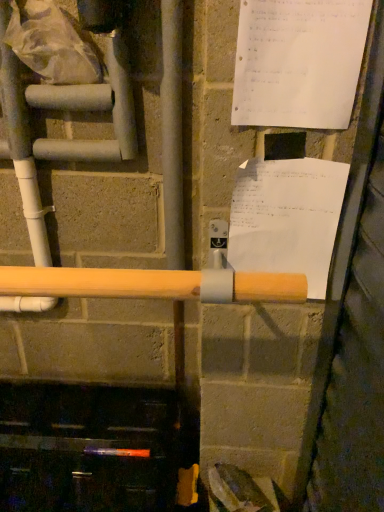
At what (x,y) coordinates should I click in order to perform the action: click on white plastic water pipe at left. Please return your answer as a coordinate pair (x, y). Looking at the image, I should click on (22, 146).

At what (x,y) coordinates should I click in order to perform the action: click on white paper at upper right, marked as the first paper in a back-to-front arrangement. Please return your answer as a coordinate pair (x, y). Image resolution: width=384 pixels, height=512 pixels. Looking at the image, I should click on (287, 218).

Identify the location of translucent plastic bag at upper left. (x=51, y=42).

What is the approximate width of translucent plastic bag at upper left?

It is 3.75 inches.

Image resolution: width=384 pixels, height=512 pixels. What do you see at coordinates (298, 62) in the screenshot? I see `white paper at upper right, the first paper when ordered from top to bottom` at bounding box center [298, 62].

Identify the location of white plastic water pipe at left. coord(22,146).

From the image's perspective, relative to white paper at upper right, the first paper when ordered from top to bottom, is white plastic water pipe at left above or below?

white plastic water pipe at left is situated lower than white paper at upper right, the first paper when ordered from top to bottom, in the image.

Do you think white plastic water pipe at left is within white paper at upper right, acting as the 1th paper starting from the front, or outside of it?

white plastic water pipe at left is located beyond the bounds of white paper at upper right, acting as the 1th paper starting from the front.

Would you consider white plastic water pipe at left to be distant from white paper at upper right, which is the second paper from back to front?

No, white plastic water pipe at left is not far from white paper at upper right, which is the second paper from back to front.

Does point (46, 237) appear closer or farther from the camera than point (336, 61)?

Point (46, 237) is farther from the camera than point (336, 61).

Does white paper at upper right, acting as the 1th paper starting from the front, lie in front of white paper at upper right, acting as the 2th paper starting from the top?

Yes, the depth of white paper at upper right, acting as the 1th paper starting from the front, is less than that of white paper at upper right, acting as the 2th paper starting from the top.

Where is `paper below the white paper at upper right, acting as the 1th paper starting from the front (from a real-world perspective)`? The image size is (384, 512). paper below the white paper at upper right, acting as the 1th paper starting from the front (from a real-world perspective) is located at coordinates (287, 218).

Does white paper at upper right, acting as the 1th paper starting from the front, turn towards white paper at upper right, positioned as the first paper in bottom-to-top order?

No, white paper at upper right, acting as the 1th paper starting from the front, is not turned towards white paper at upper right, positioned as the first paper in bottom-to-top order.

How different are the orientations of white paper at upper right, which is the second paper from back to front, and white paper at upper right, positioned as the first paper in bottom-to-top order, in degrees?

They differ by 0.0123 degrees in their facing directions.

Where is `plastic bag in front of the white plastic water pipe at left`? This screenshot has width=384, height=512. plastic bag in front of the white plastic water pipe at left is located at coordinates (51, 42).

Is white plastic water pipe at left surrounded by translucent plastic bag at upper left?

No, white plastic water pipe at left is located outside of translucent plastic bag at upper left.

Is translucent plastic bag at upper left at the right side of white plastic water pipe at left?

Correct, you'll find translucent plastic bag at upper left to the right of white plastic water pipe at left.

Which of these two, translucent plastic bag at upper left or white plastic water pipe at left, is thinner?

white plastic water pipe at left.

Can you confirm if white paper at upper right, the second paper when ordered from front to back, is positioned to the right of white paper at upper right, which is the second paper from back to front?

Incorrect, white paper at upper right, the second paper when ordered from front to back, is not on the right side of white paper at upper right, which is the second paper from back to front.

Between white paper at upper right, acting as the 2th paper starting from the top, and white paper at upper right, marked as the 2th paper in a bottom-to-top arrangement, which one has smaller width?

white paper at upper right, marked as the 2th paper in a bottom-to-top arrangement, is thinner.

From a real-world perspective, between white paper at upper right, acting as the 2th paper starting from the top, and white paper at upper right, the first paper when ordered from top to bottom, who is vertically lower?

In real-world perspective, white paper at upper right, acting as the 2th paper starting from the top, is lower.

Looking at this image, is white paper at upper right, marked as the 2th paper in a bottom-to-top arrangement, a part of white paper at upper right, marked as the first paper in a back-to-front arrangement?

That's incorrect, white paper at upper right, marked as the 2th paper in a bottom-to-top arrangement, is not inside white paper at upper right, marked as the first paper in a back-to-front arrangement.

How different are the orientations of white paper at upper right, marked as the first paper in a back-to-front arrangement, and translucent plastic bag at upper left in degrees?

The angle between the facing direction of white paper at upper right, marked as the first paper in a back-to-front arrangement, and the facing direction of translucent plastic bag at upper left is 2.91 degrees.

Is white paper at upper right, the second paper when ordered from front to back, inside the boundaries of translucent plastic bag at upper left, or outside?

white paper at upper right, the second paper when ordered from front to back, is located beyond the bounds of translucent plastic bag at upper left.

How much distance is there between white paper at upper right, marked as the first paper in a back-to-front arrangement, and translucent plastic bag at upper left?

A distance of 20.16 inches exists between white paper at upper right, marked as the first paper in a back-to-front arrangement, and translucent plastic bag at upper left.

From a real-world perspective, between white paper at upper right, marked as the first paper in a back-to-front arrangement, and translucent plastic bag at upper left, who is vertically higher?

In real-world perspective, translucent plastic bag at upper left is above.

Does translucent plastic bag at upper left have a greater height compared to white paper at upper right, positioned as the first paper in bottom-to-top order?

No.

Is the depth of translucent plastic bag at upper left greater than that of white paper at upper right, acting as the 2th paper starting from the top?

Yes, it is.

Is translucent plastic bag at upper left oriented away from white paper at upper right, positioned as the first paper in bottom-to-top order?

No, translucent plastic bag at upper left is not facing the opposite direction of white paper at upper right, positioned as the first paper in bottom-to-top order.

Identify the location of plastic bag that appears above the white plastic water pipe at left (from the image's perspective). This screenshot has height=512, width=384. (51, 42).

Between point (36, 172) and point (80, 53), which one is positioned behind?

Positioned behind is point (36, 172).

From the image's perspective, which is above, white plastic water pipe at left or translucent plastic bag at upper left?

translucent plastic bag at upper left is shown above in the image.

The image size is (384, 512). Find the location of `water pipe that is behind the white paper at upper right, acting as the 1th paper starting from the front`. water pipe that is behind the white paper at upper right, acting as the 1th paper starting from the front is located at coordinates (22, 146).

In order to click on paper on the left of the white paper at upper right, marked as the 2th paper in a bottom-to-top arrangement in this screenshot , I will do `click(287, 218)`.

When comparing their distances from white plastic water pipe at left, does translucent plastic bag at upper left or white paper at upper right, positioned as the first paper in bottom-to-top order, seem closer?

translucent plastic bag at upper left.

Which object lies nearer to the anchor point translucent plastic bag at upper left, white paper at upper right, acting as the 1th paper starting from the front, or white plastic water pipe at left?

white plastic water pipe at left.

In the scene shown: When comparing their distances from white plastic water pipe at left, does white paper at upper right, which is the second paper from back to front, or translucent plastic bag at upper left seem further?

white paper at upper right, which is the second paper from back to front, is further to white plastic water pipe at left.

Looking at this image, when comparing their distances from translucent plastic bag at upper left, does white plastic water pipe at left or white paper at upper right, acting as the 1th paper starting from the front, seem further?

Based on the image, white paper at upper right, acting as the 1th paper starting from the front, appears to be further to translucent plastic bag at upper left.

From the picture: From the image, which object appears to be nearer to white paper at upper right, marked as the first paper in a back-to-front arrangement, translucent plastic bag at upper left or white paper at upper right, marked as the 2th paper in a bottom-to-top arrangement?

white paper at upper right, marked as the 2th paper in a bottom-to-top arrangement, lies closer to white paper at upper right, marked as the first paper in a back-to-front arrangement, than the other object.

Considering their positions, is white paper at upper right, the first paper when ordered from top to bottom, positioned closer to white paper at upper right, positioned as the first paper in bottom-to-top order, than white plastic water pipe at left?

Based on the image, white paper at upper right, the first paper when ordered from top to bottom, appears to be nearer to white paper at upper right, positioned as the first paper in bottom-to-top order.

Which object lies further to the anchor point translucent plastic bag at upper left, white plastic water pipe at left or white paper at upper right, positioned as the first paper in bottom-to-top order?

white paper at upper right, positioned as the first paper in bottom-to-top order, lies further to translucent plastic bag at upper left than the other object.

In the scene shown: Estimate the real-world distances between objects in this image. Which object is further from white plastic water pipe at left, white paper at upper right, the first paper when ordered from top to bottom, or white paper at upper right, marked as the first paper in a back-to-front arrangement?

Among the two, white paper at upper right, marked as the first paper in a back-to-front arrangement, is located further to white plastic water pipe at left.

The height and width of the screenshot is (512, 384). What are the coordinates of `paper between translucent plastic bag at upper left and white paper at upper right, acting as the 1th paper starting from the front, from left to right` in the screenshot? It's located at (287, 218).

Find the location of a particular element. plastic bag between white plastic water pipe at left and white paper at upper right, acting as the 2th paper starting from the top, from left to right is located at coordinates (51, 42).

You are a GUI agent. You are given a task and a screenshot of the screen. Output one action in this format:
    pyautogui.click(x=<x>, y=<y>)
    Task: Click on the paper between white plastic water pipe at left and white paper at upper right, the first paper when ordered from top to bottom
    Image resolution: width=384 pixels, height=512 pixels.
    Given the screenshot: What is the action you would take?
    pyautogui.click(x=287, y=218)

You are a GUI agent. You are given a task and a screenshot of the screen. Output one action in this format:
    pyautogui.click(x=<x>, y=<y>)
    Task: Click on the plastic bag located between white plastic water pipe at left and white paper at upper right, which is the second paper from back to front, in the left-right direction
    
    Given the screenshot: What is the action you would take?
    pyautogui.click(x=51, y=42)